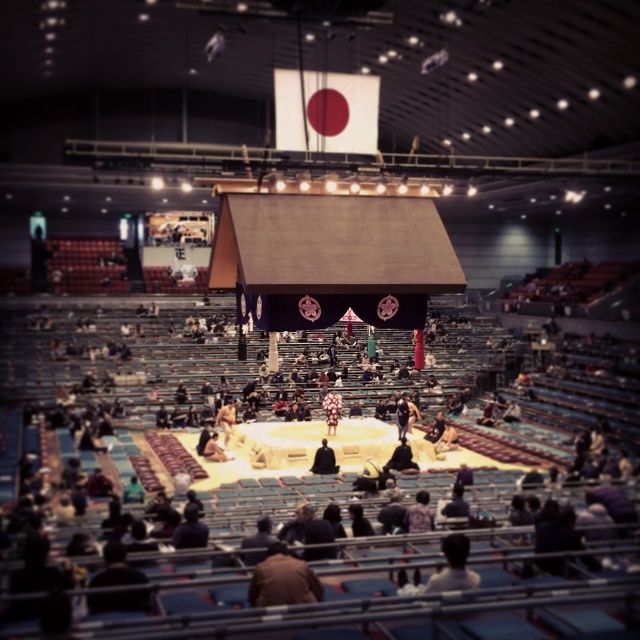
You are standing in the arena and want to reach a specific point marked at coordinates point (276, 584). If your current position is 20 feet away from this point, how much further do you need to walk to reach it?

The distance of point (276, 584) from viewer is 34.03 feet. Since you are currently 20 feet away, you need to walk an additional 14.03 feet to reach it.

You are a spectator at the sumo wrestling event and you want to sit in the seat closest to the dark brown leather jacket at lower center. Which direction should you walk from your current position at point 0.5, 0.5?

The dark brown leather jacket at lower center is located at point (419, 513). Since your current position is at point (320, 320), you should walk southeast to reach the seat closest to the jacket.